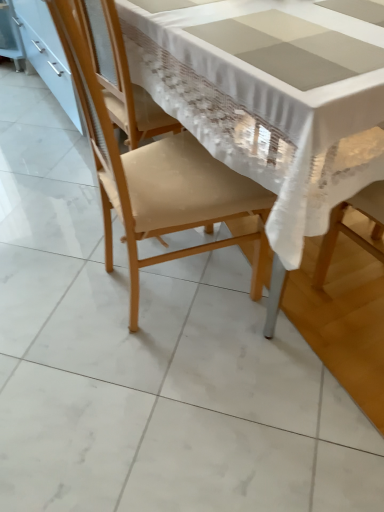
Question: Is matte beige chair at center bigger than white lace tablecloth at center?

Choices:
 (A) no
 (B) yes

Answer: (A)

Question: Can white lace tablecloth at center be found inside matte beige chair at center?

Choices:
 (A) no
 (B) yes

Answer: (A)

Question: Does matte beige chair at center have a lesser width compared to white lace tablecloth at center?

Choices:
 (A) no
 (B) yes

Answer: (B)

Question: Does matte beige chair at center touch white lace tablecloth at center?

Choices:
 (A) yes
 (B) no

Answer: (B)

Question: Could you tell me if matte beige chair at center is facing white lace tablecloth at center?

Choices:
 (A) no
 (B) yes

Answer: (B)

Question: Looking at their shapes, would you say white glossy cabinet at left is wider or thinner than matte beige chair at center?

Choices:
 (A) thin
 (B) wide

Answer: (A)

Question: Is white glossy cabinet at left bigger or smaller than matte beige chair at center?

Choices:
 (A) big
 (B) small

Answer: (A)

Question: Is white glossy cabinet at left in front of or behind matte beige chair at center in the image?

Choices:
 (A) front
 (B) behind

Answer: (B)

Question: Considering the positions of point (82, 126) and point (150, 174), is point (82, 126) closer or farther from the camera than point (150, 174)?

Choices:
 (A) farther
 (B) closer

Answer: (A)

Question: Is matte beige chair at center wider or thinner than white lace tablecloth at center?

Choices:
 (A) thin
 (B) wide

Answer: (A)

Question: From a real-world perspective, relative to white lace tablecloth at center, is matte beige chair at center vertically above or below?

Choices:
 (A) below
 (B) above

Answer: (B)

Question: Do you think matte beige chair at center is within white lace tablecloth at center, or outside of it?

Choices:
 (A) inside
 (B) outside

Answer: (A)

Question: Is point (180, 212) positioned closer to the camera than point (258, 166)?

Choices:
 (A) farther
 (B) closer

Answer: (A)

Question: Relative to white glossy cabinet at left, is white lace tablecloth at center in front or behind?

Choices:
 (A) behind
 (B) front

Answer: (B)

Question: Considering the positions of white lace tablecloth at center and white glossy cabinet at left in the image, is white lace tablecloth at center wider or thinner than white glossy cabinet at left?

Choices:
 (A) thin
 (B) wide

Answer: (B)